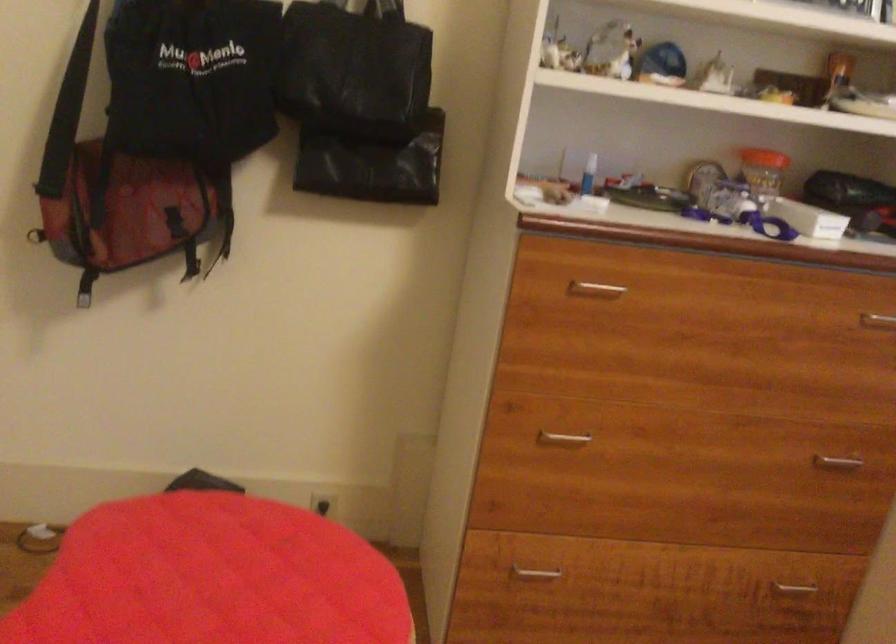
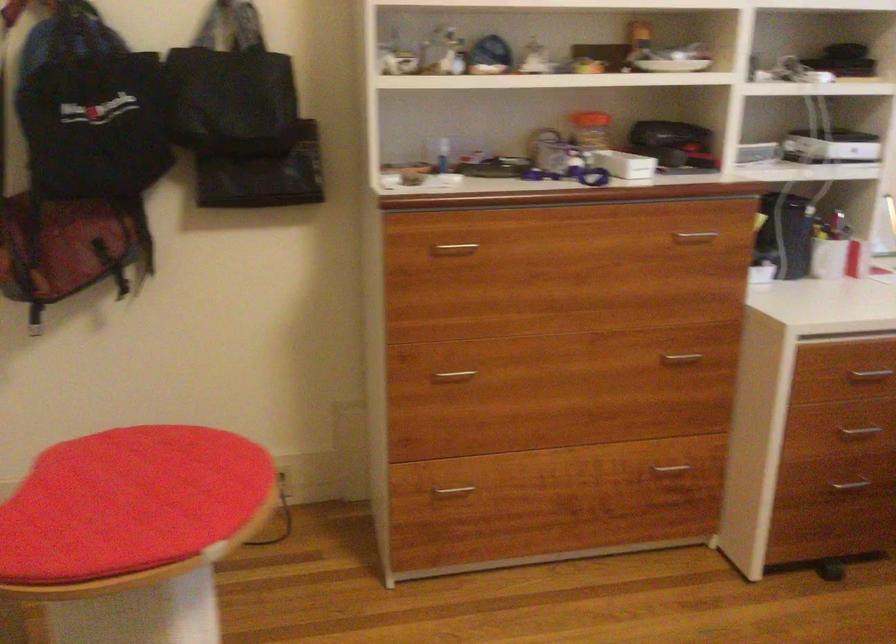
The images are taken continuously from a first-person perspective. In which direction are you moving?

The movement direction of the cameraman is right, backward.